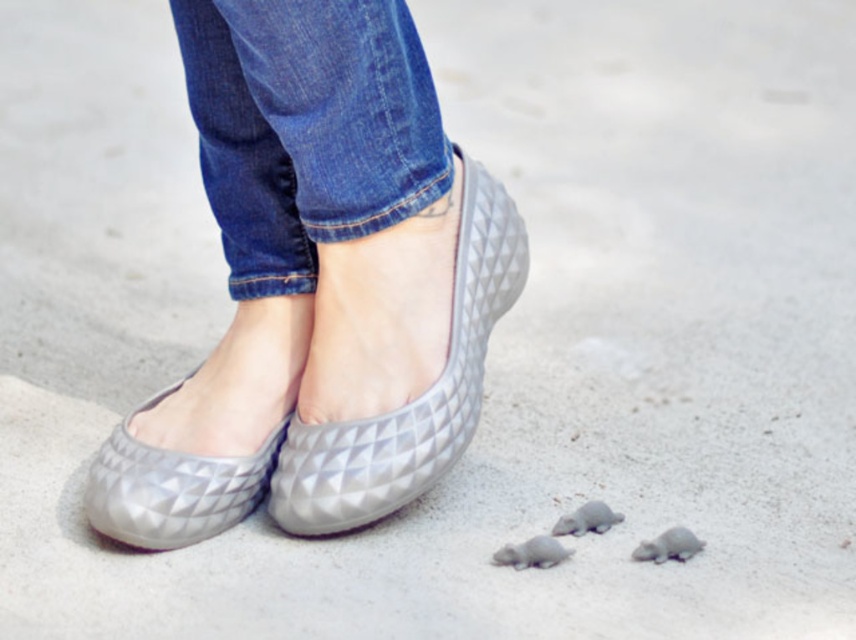
Question: Does matte gray shoes at center lie behind matte rubber mouse at lower right?

Choices:
 (A) no
 (B) yes

Answer: (A)

Question: Among these points, which one is farthest from the camera?

Choices:
 (A) (672, 548)
 (B) (452, 419)
 (C) (278, 349)

Answer: (C)

Question: Does matte gray shoes at center come in front of matte rubber mouse at lower right?

Choices:
 (A) yes
 (B) no

Answer: (A)

Question: Is denim at center bigger than matte rubber sandal at center?

Choices:
 (A) yes
 (B) no

Answer: (A)

Question: Which object is closer to the camera taking this photo?

Choices:
 (A) matte gray shoes at center
 (B) matte gray slip-on shoe at center

Answer: (A)

Question: Which of the following is the closest to the observer?

Choices:
 (A) (192, 92)
 (B) (423, 472)
 (C) (599, 524)
 (D) (557, 560)

Answer: (D)